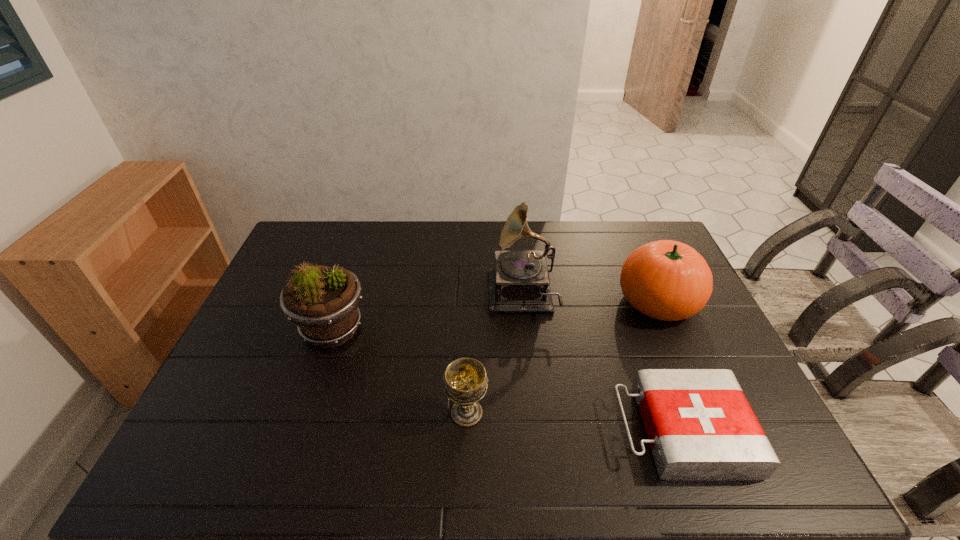
You are a GUI agent. You are given a task and a screenshot of the screen. Output one action in this format:
    pyautogui.click(x=<x>, y=<y>)
    Task: Click on the free spot located on the left of the third shortest object
    
    Given the screenshot: What is the action you would take?
    pyautogui.click(x=518, y=301)

The width and height of the screenshot is (960, 540). In order to click on free region located on the right of the second object from left to right in this screenshot , I will do point(548,413).

In order to click on free space located 0.190m on the front side of the first-aid kit in this screenshot , I will do `click(539, 431)`.

This screenshot has height=540, width=960. I want to click on vacant space located on the front side of the first-aid kit, so click(x=597, y=431).

Find the location of a particular element. The height and width of the screenshot is (540, 960). vacant space located on the front side of the first-aid kit is located at coordinates (464, 431).

Locate an element on the screen. object that is at the near edge is located at coordinates coord(700,426).

At what (x,y) coordinates should I click in order to perform the action: click on object that is at the left edge. Please return your answer as a coordinate pair (x, y). This screenshot has height=540, width=960. Looking at the image, I should click on (322, 301).

You are a GUI agent. You are given a task and a screenshot of the screen. Output one action in this format:
    pyautogui.click(x=<x>, y=<y>)
    Task: Click on the pumpkin situated at the right edge
    This screenshot has width=960, height=540.
    Given the screenshot: What is the action you would take?
    pyautogui.click(x=668, y=280)

Find the location of a particular element. Image resolution: width=960 pixels, height=540 pixels. the first-aid kit that is at the right edge is located at coordinates (700, 426).

Where is `object that is at the near right corner`? Image resolution: width=960 pixels, height=540 pixels. object that is at the near right corner is located at coordinates click(700, 426).